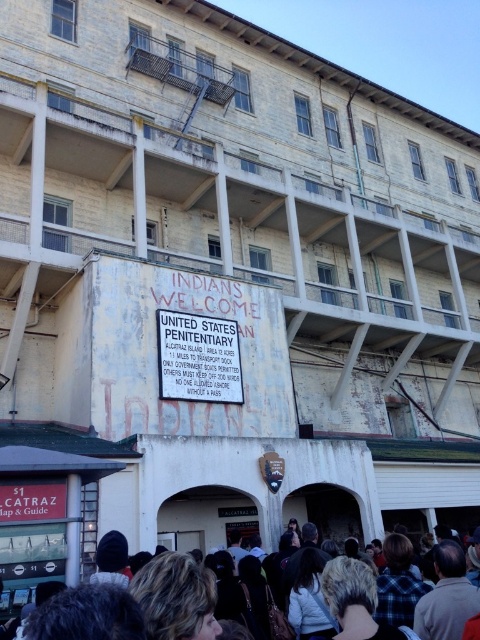
You are a tour guide at Alcatraz Island. You notice a visitor pointing at the dark hair at lower center and the white paper sign at center. They ask which one is closer to the ground. What do you tell them?

The dark hair at lower center is closer to the ground because it is located below the white paper sign at center.

You are a tour guide explaining the historical significance of the Alcatraz Island Penitentiary. You notice a visitor pointing at the dark hair at lower center and the white paper sign at center. They ask, which of these two items is wider? Please explain your answer based on their sizes.

The dark hair at lower center is wider than the white paper sign at center, as stated in the description.

You are a tour guide standing in front of the Alcatraz Island Penitentiary building. You notice two items in the scene described in the image. One is the dark hair at lower center, and the other is the white paper sign at center. Which of these two items is taller?

The dark hair at lower center is taller than the white paper sign at center according to the description.